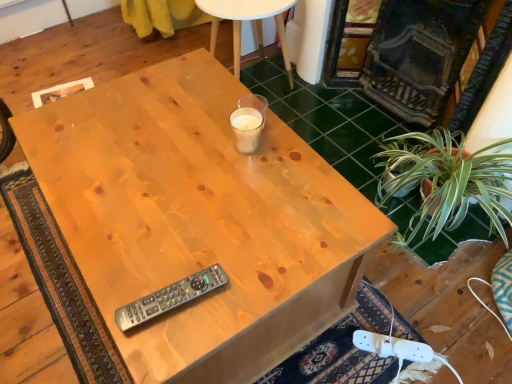
Image resolution: width=512 pixels, height=384 pixels. Identify the location of empty space that is in between gray plastic remote at center and translucent glass candle at center, marked as the first coffee cup in a bottom-to-top arrangement. (208, 215).